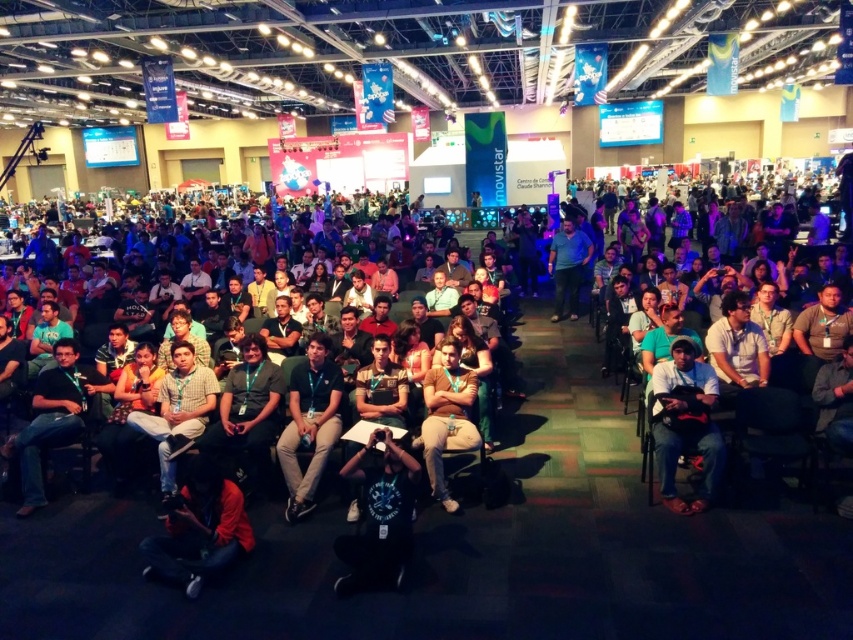
You are at the center of the event space and want to find the dark blue jeans at center. In which direction should you look to see them?

The dark blue jeans at center are located at the center of the event space, so you should look straight ahead to see them.

You are an event organizer and need to ensure that all attendees in the front row can see the stage clearly. Given that the green fabric shirt at center and brown cotton shirt at center are both in the front row, which attendee might be blocking the view of the other?

The brown cotton shirt at center is behind the green fabric shirt at center, so the green fabric shirt at center might be blocking the view of the brown cotton shirt at center.